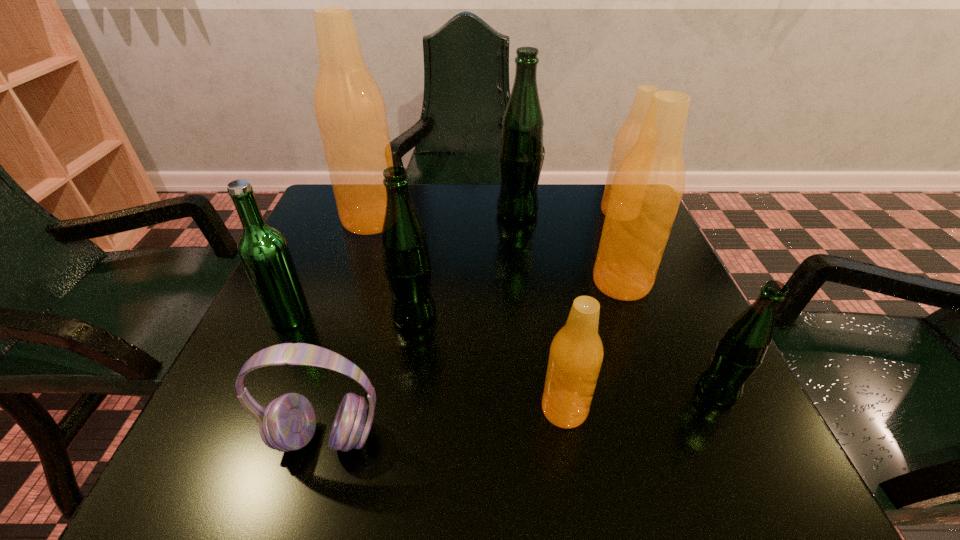
The width and height of the screenshot is (960, 540). Find the location of `the nearest tan beer bottle`. the nearest tan beer bottle is located at coordinates (576, 354).

Find the location of a particular element. Image resolution: width=960 pixels, height=540 pixels. the smallest tan beer bottle is located at coordinates (576, 354).

Find the location of a particular element. This screenshot has width=960, height=540. the shortest object is located at coordinates (288, 423).

You are a GUI agent. You are given a task and a screenshot of the screen. Output one action in this format:
    pyautogui.click(x=<x>, y=<y>)
    Task: Click on the vacant space situated on the right of the biggest tan beer bottle
    This screenshot has height=540, width=960.
    Given the screenshot: What is the action you would take?
    pyautogui.click(x=512, y=219)

The width and height of the screenshot is (960, 540). Identify the location of free point located 0.130m on the right of the third green beer bottle from left to right. (590, 213).

Identify the location of vacant space located on the front of the third smallest tan beer bottle. pyautogui.click(x=650, y=360).

Identify the location of free point located on the back of the third biggest tan beer bottle. The image size is (960, 540). (610, 188).

You are a GUI agent. You are given a task and a screenshot of the screen. Output one action in this format:
    pyautogui.click(x=<x>, y=<y>)
    Task: Click on the vacant space located 0.110m on the left of the third beer bottle from left to right
    The width and height of the screenshot is (960, 540).
    Given the screenshot: What is the action you would take?
    pyautogui.click(x=333, y=316)

At what (x,y) coordinates should I click in order to perform the action: click on vacant space situated 0.110m on the back of the leftmost green beer bottle. Please return your answer as a coordinate pair (x, y). This screenshot has width=960, height=540. Looking at the image, I should click on (312, 267).

Image resolution: width=960 pixels, height=540 pixels. In order to click on free space located on the left of the nearest green beer bottle in this screenshot , I will do `click(453, 391)`.